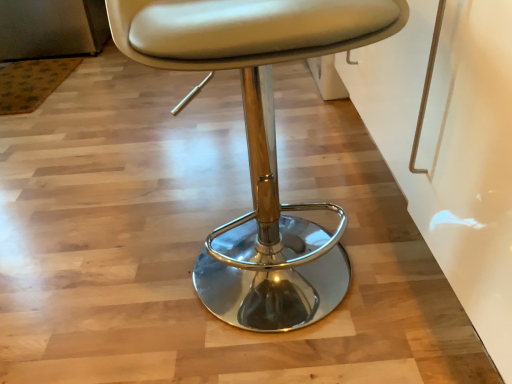
The height and width of the screenshot is (384, 512). What are the coordinates of `free space behind beige leather stool at center` in the screenshot? It's located at (241, 184).